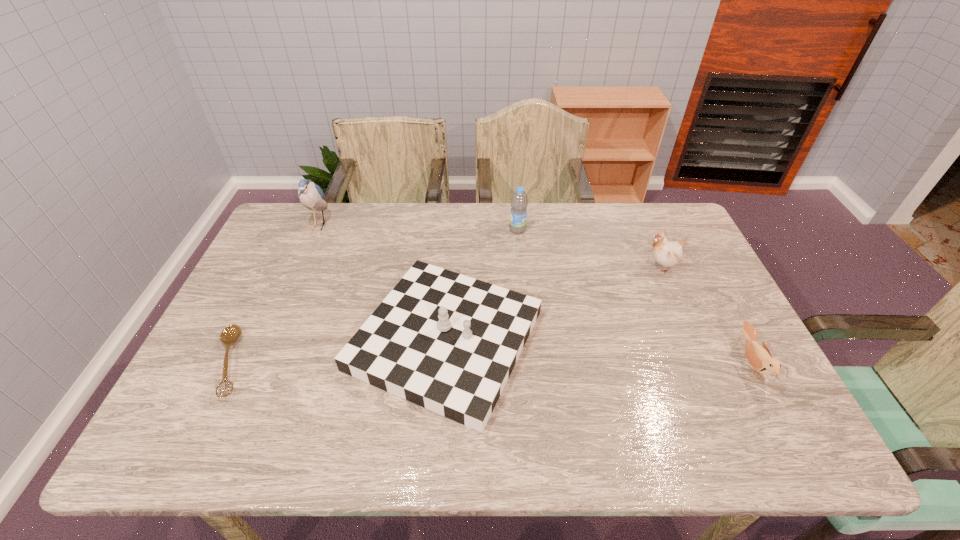
Find the location of a particular element. The width and height of the screenshot is (960, 540). vacant space positioned 0.250m on the right of the second tallest object is located at coordinates (600, 230).

Locate an element on the screen. The image size is (960, 540). vacant area situated 0.260m at the beak of the second nearest bird is located at coordinates (558, 267).

This screenshot has height=540, width=960. In order to click on vacant space located at the beak of the second nearest bird in this screenshot , I will do `click(541, 267)`.

Locate an element on the screen. vacant space located at the beak of the second nearest bird is located at coordinates (525, 267).

Identify the location of free location located on the right of the checkerboard. The image size is (960, 540). (666, 340).

This screenshot has width=960, height=540. Find the location of `free space located 0.150m at the beak of the rightmost object`. free space located 0.150m at the beak of the rightmost object is located at coordinates (679, 365).

You are a GUI agent. You are given a task and a screenshot of the screen. Output one action in this format:
    pyautogui.click(x=<x>, y=<y>)
    Task: Click on the free space located at the beak of the rightmost object
    This screenshot has height=540, width=960.
    Given the screenshot: What is the action you would take?
    pyautogui.click(x=594, y=365)

You are a GUI agent. You are given a task and a screenshot of the screen. Output one action in this format:
    pyautogui.click(x=<x>, y=<y>)
    Task: Click on the blank area located at the beak of the rightmost object
    
    Given the screenshot: What is the action you would take?
    pyautogui.click(x=627, y=365)

The height and width of the screenshot is (540, 960). I want to click on vacant space located 0.290m on the right of the shortest object, so click(x=367, y=362).

Find the location of a particular element. Image resolution: width=960 pixels, height=540 pixels. bird that is at the far edge is located at coordinates point(311,195).